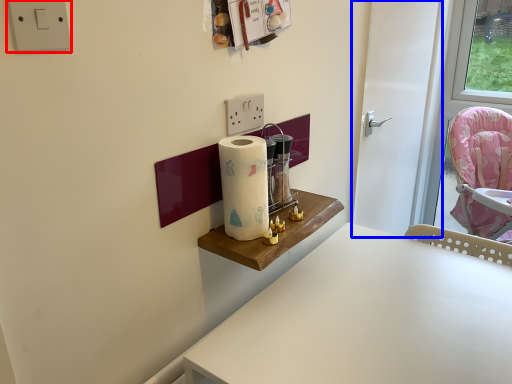
Question: Which object appears closest to the camera in this image, electric outlet (highlighted by a red box) or door (highlighted by a blue box)?

Choices:
 (A) electric outlet
 (B) door

Answer: (A)